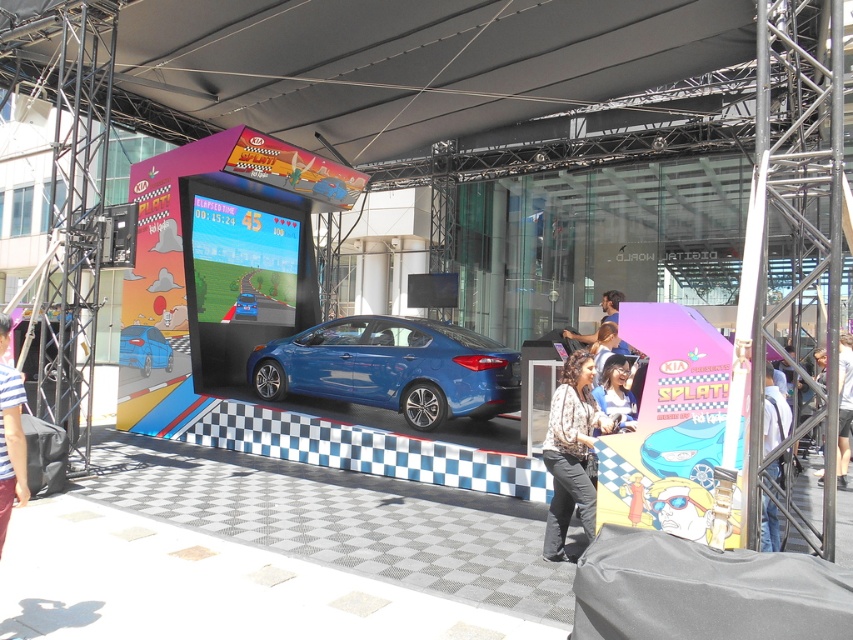
Consider the image. You are standing at the entrance of the Kia promotional setup. You see a point labeled as point (444, 80). What object is located at this point?

The point (444, 80) corresponds to the matte black canopy at upper center.

You are a visitor at the promotional event and want to take a photo of the striped fabric shirt at lower left without the matte black canopy at upper center appearing in the frame. Is this possible based on their positions?

The matte black canopy at upper center is further to the viewer than the striped fabric shirt at lower left, so it is blocking the view. Therefore, it is not possible to take a photo of the striped fabric shirt at lower left without the matte black canopy at upper center appearing in the frame.

You are a participant in the car promotion event and want to pick up your prize bag. You see the white fabric bag at lower right and the light brown hair at center. Which object is lower in position?

The white fabric bag at lower right is located below light brown hair at center, so the white fabric bag at lower right is lower in position.